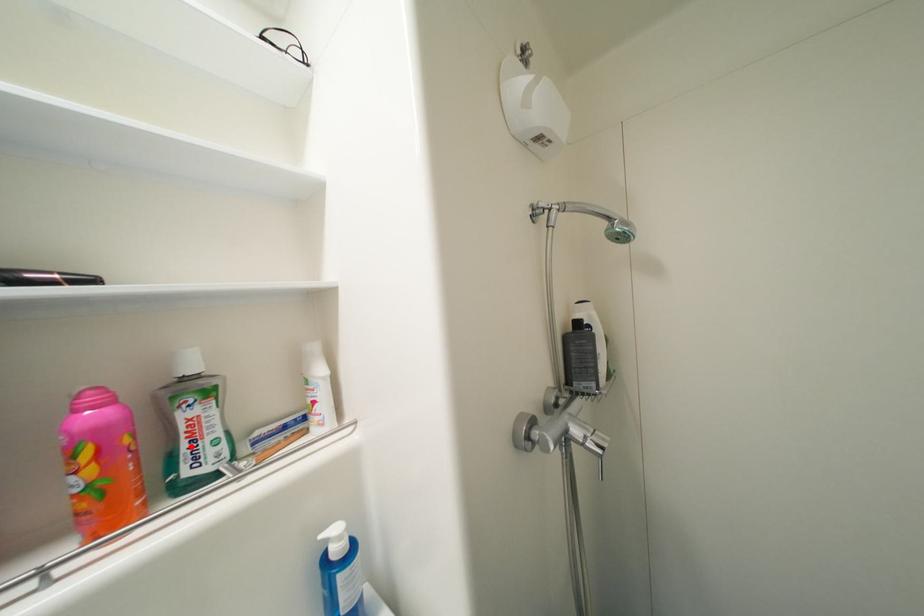
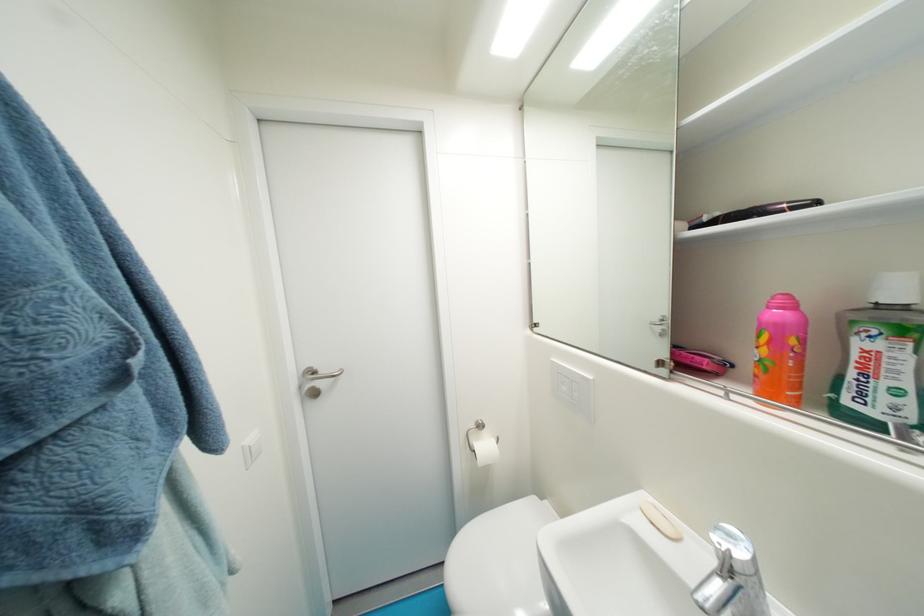
Where in the second image is the point corresponding to the highlighted location from the first image?

(858, 376)